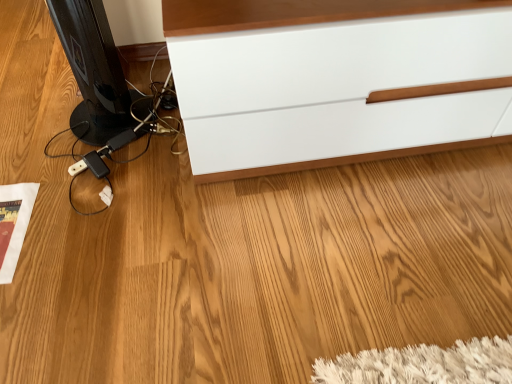
Where is `vacant space to the left of black glossy computer monitor at left`? The width and height of the screenshot is (512, 384). vacant space to the left of black glossy computer monitor at left is located at coordinates (38, 116).